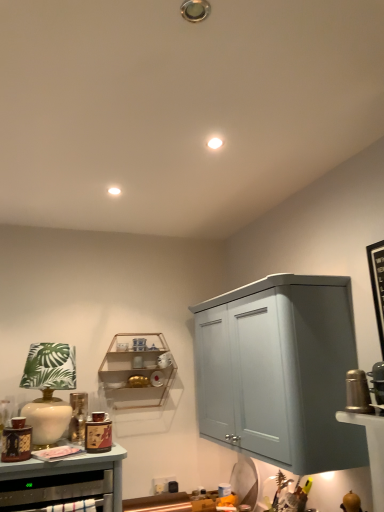
Question: Is wooden shelf at center thinner than matte brown cabinet at lower left?

Choices:
 (A) no
 (B) yes

Answer: (B)

Question: Does wooden shelf at center touch matte brown cabinet at lower left?

Choices:
 (A) no
 (B) yes

Answer: (A)

Question: From a real-world perspective, is wooden shelf at center on top of matte brown cabinet at lower left?

Choices:
 (A) no
 (B) yes

Answer: (B)

Question: Considering the relative sizes of wooden shelf at center and matte brown cabinet at lower left in the image provided, is wooden shelf at center bigger than matte brown cabinet at lower left?

Choices:
 (A) no
 (B) yes

Answer: (A)

Question: Could you tell me if wooden shelf at center is facing matte brown cabinet at lower left?

Choices:
 (A) no
 (B) yes

Answer: (A)

Question: Is wooden shelf at center smaller than matte brown cabinet at lower left?

Choices:
 (A) yes
 (B) no

Answer: (A)

Question: Does matte brown cabinet at lower left turn towards white ceramic table lamp at left?

Choices:
 (A) yes
 (B) no

Answer: (B)

Question: Is matte brown cabinet at lower left looking in the opposite direction of white ceramic table lamp at left?

Choices:
 (A) no
 (B) yes

Answer: (A)

Question: Is matte brown cabinet at lower left smaller than white ceramic table lamp at left?

Choices:
 (A) no
 (B) yes

Answer: (A)

Question: From a real-world perspective, is matte brown cabinet at lower left physically above white ceramic table lamp at left?

Choices:
 (A) no
 (B) yes

Answer: (A)

Question: From the image's perspective, does matte brown cabinet at lower left appear lower than white ceramic table lamp at left?

Choices:
 (A) no
 (B) yes

Answer: (B)

Question: Can you confirm if matte brown cabinet at lower left is taller than white ceramic table lamp at left?

Choices:
 (A) no
 (B) yes

Answer: (A)

Question: Is white ceramic table lamp at left closer to camera compared to matte brown cabinet at lower left?

Choices:
 (A) yes
 (B) no

Answer: (B)